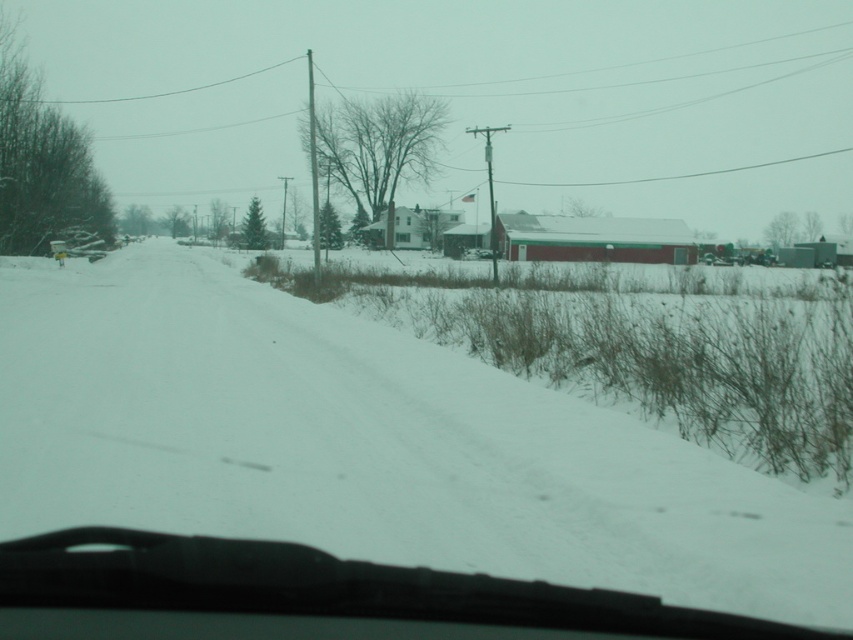
Question: Which point is closer to the camera taking this photo?

Choices:
 (A) (805, 586)
 (B) (115, 554)

Answer: (B)

Question: Can you confirm if white powdery snow at center is smaller than transparent rubber windshield at center?

Choices:
 (A) yes
 (B) no

Answer: (B)

Question: Is the position of white powdery snow at center more distant than that of transparent rubber windshield at center?

Choices:
 (A) no
 (B) yes

Answer: (B)

Question: Which object is closer to the camera taking this photo?

Choices:
 (A) white powdery snow at center
 (B) transparent rubber windshield at center

Answer: (B)

Question: Is white powdery snow at center to the left of transparent rubber windshield at center from the viewer's perspective?

Choices:
 (A) yes
 (B) no

Answer: (A)